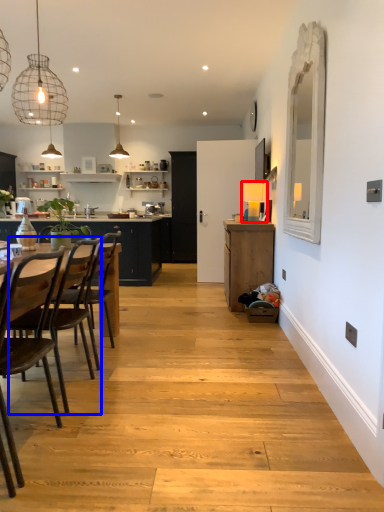
Question: Among these objects, which one is farthest to the camera, lamp (highlighted by a red box) or chair (highlighted by a blue box)?

Choices:
 (A) lamp
 (B) chair

Answer: (A)